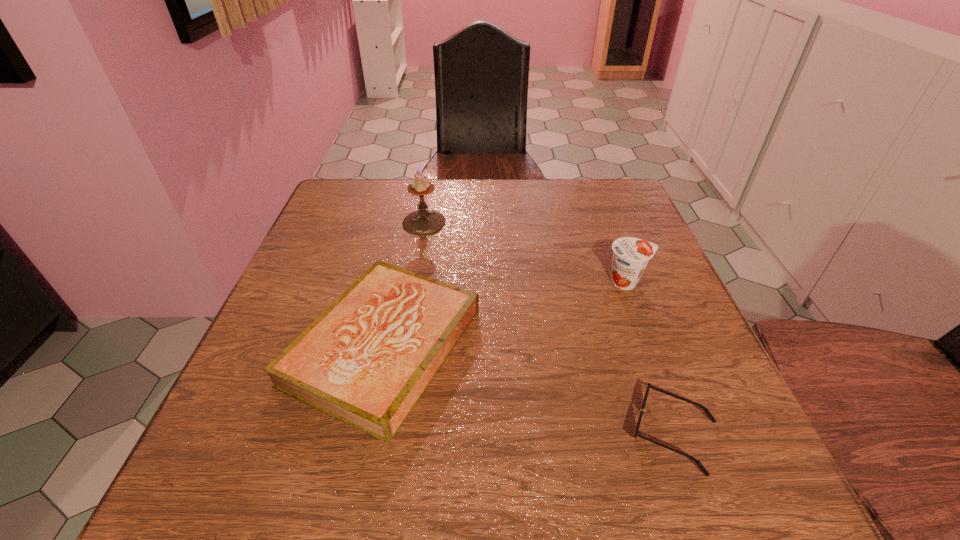
You are a GUI agent. You are given a task and a screenshot of the screen. Output one action in this format:
    pyautogui.click(x=<x>, y=<y>)
    Task: Click on the vacant area between the hardback book and the third shortest object
    This screenshot has width=960, height=540.
    Given the screenshot: What is the action you would take?
    (x=505, y=314)

The height and width of the screenshot is (540, 960). In order to click on free spot between the farthest object and the yogurt in this screenshot , I will do `click(525, 252)`.

The height and width of the screenshot is (540, 960). Find the location of `object that is the second closest to the third tallest object`. object that is the second closest to the third tallest object is located at coordinates (649, 386).

Locate which object ranks second in proximity to the shortest object. Please provide its 2D coordinates. Your answer should be formatted as a tuple, i.e. [(x, y)], where the tuple contains the x and y coordinates of a point satisfying the conditions above.

[(630, 255)]